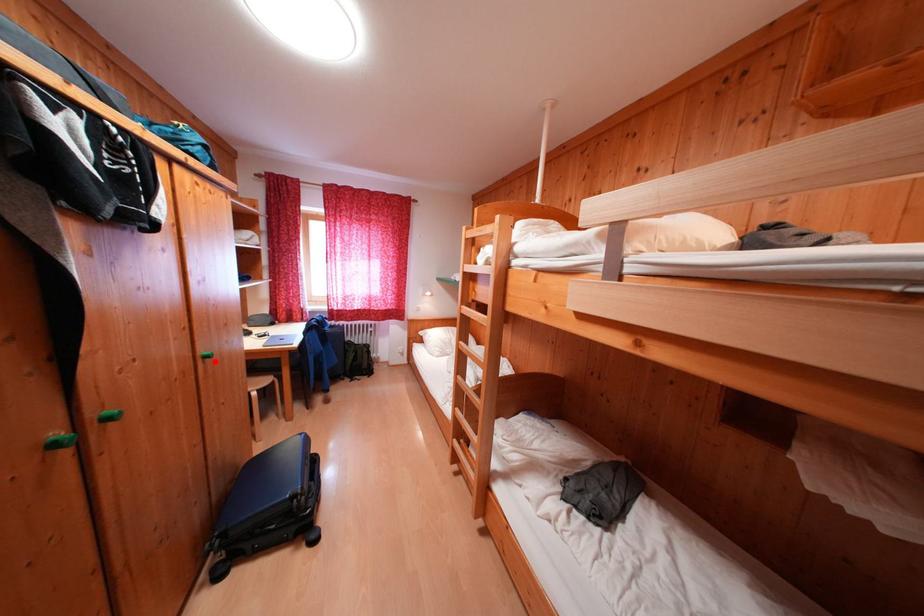
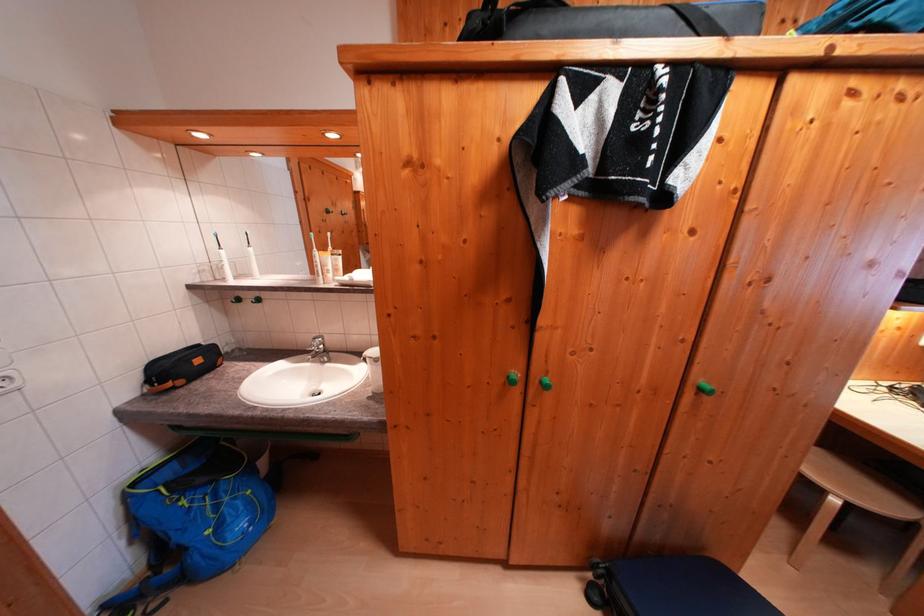
In the second image, find the point that corresponds to the highlighted location in the first image.

(709, 394)